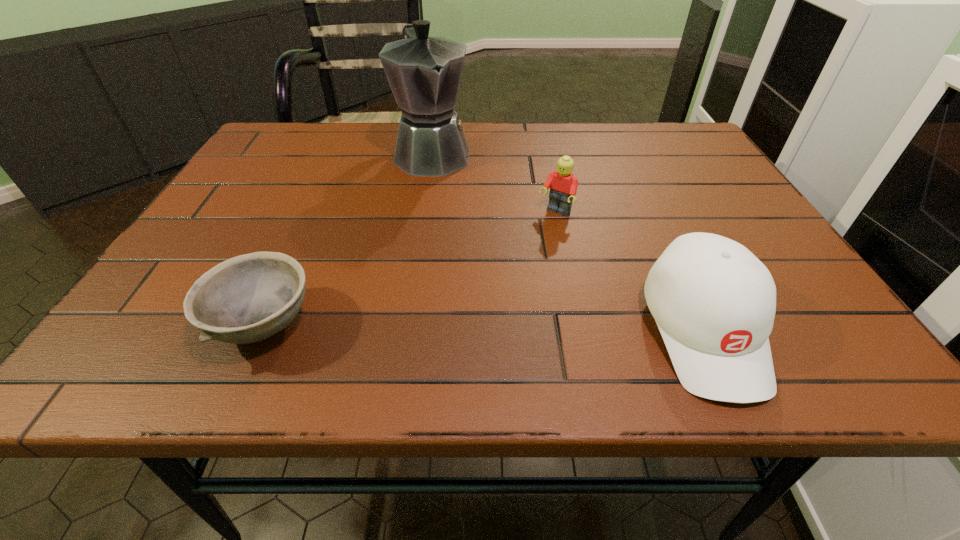
What are the coordinates of `free point that satisfies the following two spatial constraints: 1. on the back side of the shortest object; 2. on the left side of the Lego` in the screenshot? It's located at (315, 212).